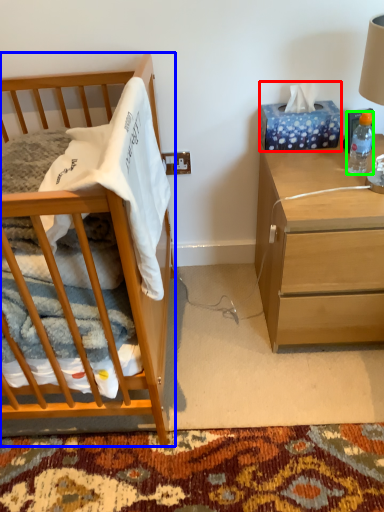
Question: Considering the real-world distances, which object is farthest from tissue paper (highlighted by a red box)? cabinetry (highlighted by a blue box) or bottle (highlighted by a green box)?

Choices:
 (A) cabinetry
 (B) bottle

Answer: (A)